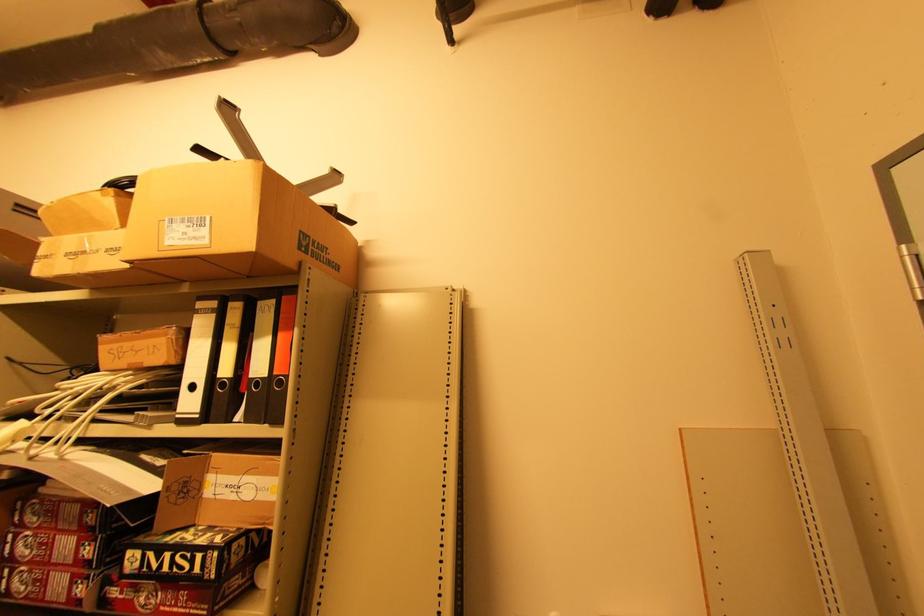
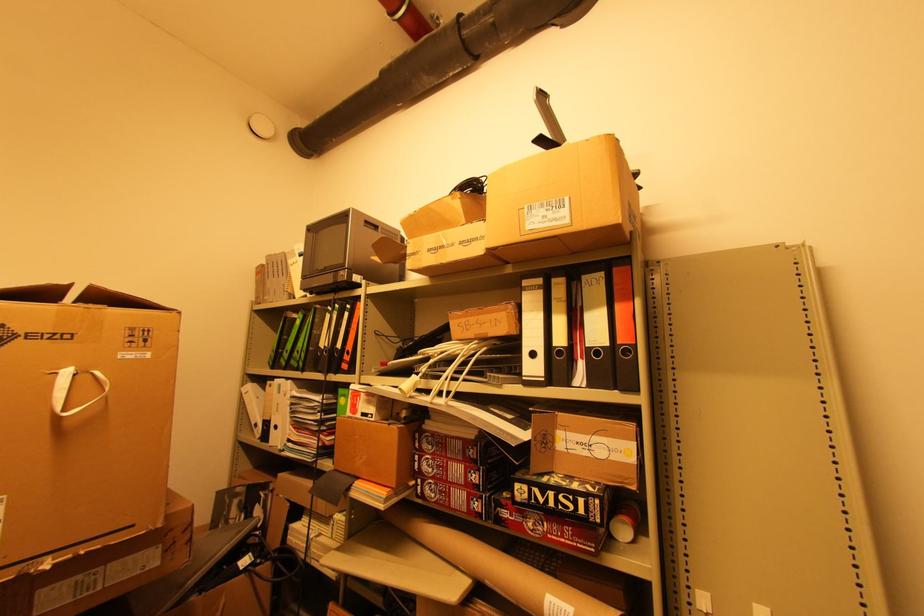
Question: What movement of the cameraman would produce the second image?

Choices:
 (A) Left
 (B) Right
 (C) Forward
 (D) Backward

Answer: (A)